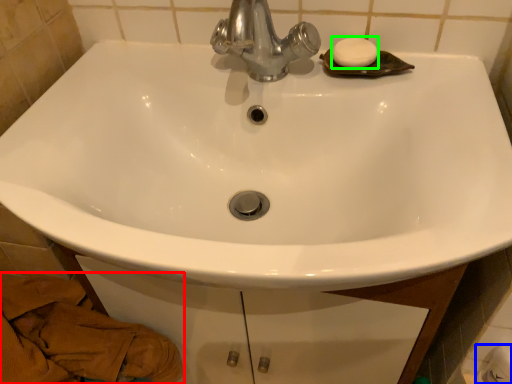
Question: Which is nearer to the material (highlighted by a red box)? toilet paper (highlighted by a blue box) or soap (highlighted by a green box).

Choices:
 (A) toilet paper
 (B) soap

Answer: (B)